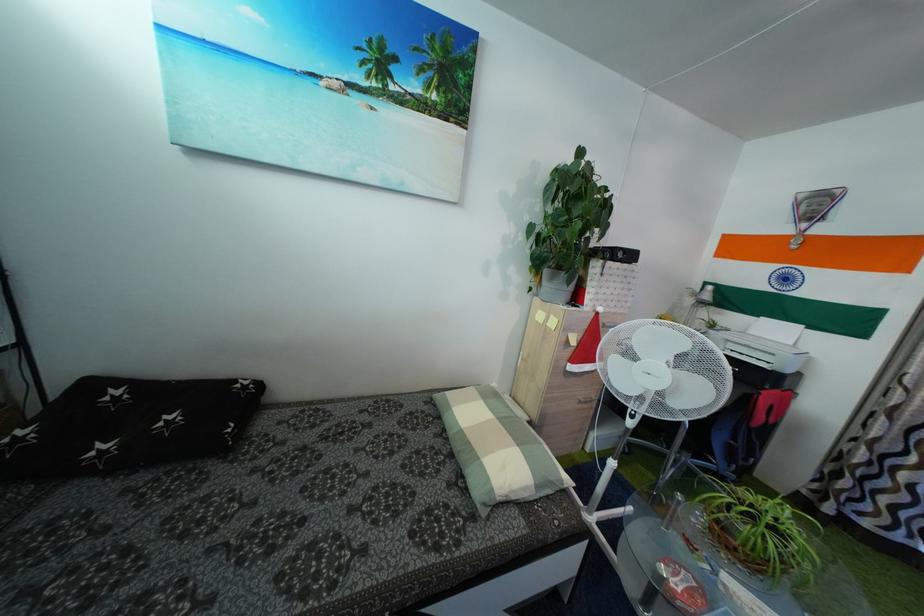
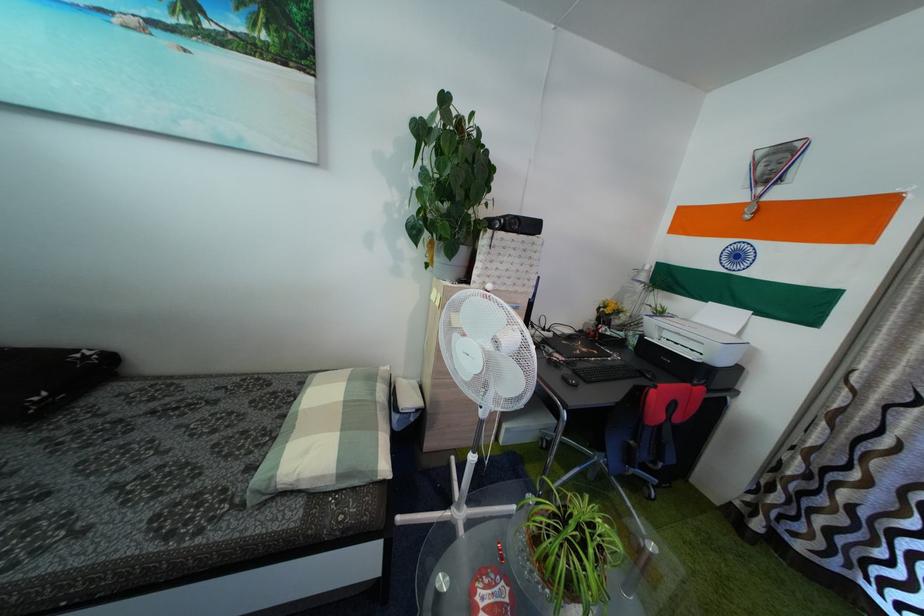
Locate, in the second image, the point that corresponds to (539,297) in the first image.

(435, 273)